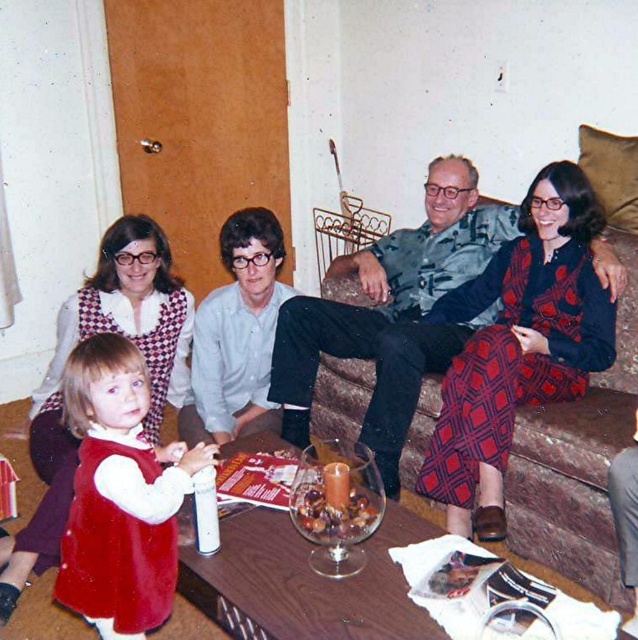
Consider the image. You are a photographer trying to capture a closeup of the patterned fabric dress at center and the velvet red dress at lower left. Which dress should you focus on first if you want to ensure both are in the frame without moving the camera?

The patterned fabric dress at center is located above the velvet red dress at lower left, so you should focus on the velvet red dress at lower left first to ensure both are in the frame without moving the camera.

In the living room scene, there are two dresses displayed. The first is a patterned fabric dress at center, and the second is a velvet red dress at lower left. Which dress is taller?

The patterned fabric dress at center is much taller than the velvet red dress at lower left.